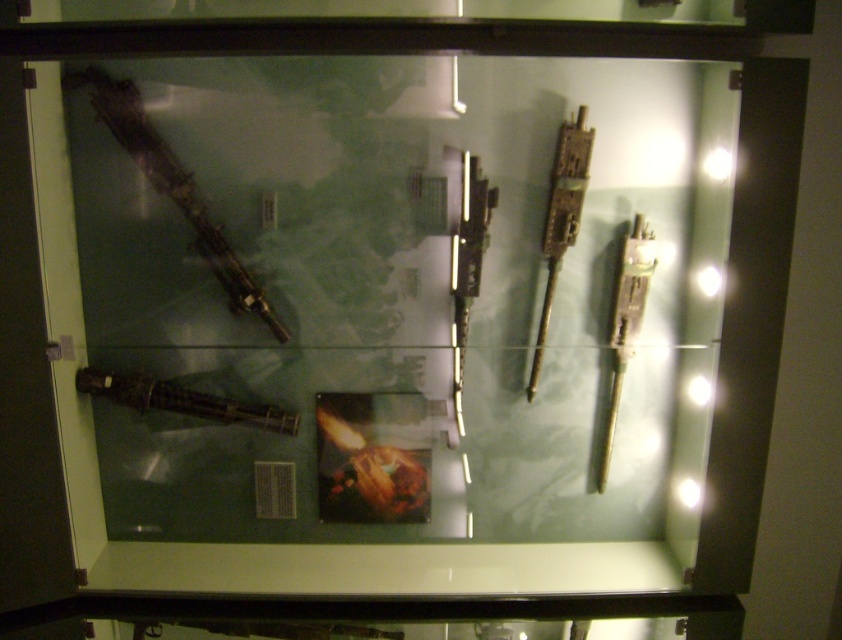
You are a museum visitor standing in front of the display case. You see a point marked at coordinates (x=561, y=218). What object is located at that point?

The point at coordinates (x=561, y=218) indicates the rusty metal gun at upper right.

You are a museum security guard checking the display case. You notice the matte black gun at left and the metallic silver gun at center. Which gun is placed above the other in the display?

The matte black gun at left is positioned over the metallic silver gun at center in the display case.

You are a museum visitor standing in front of the display case. You notice the matte black gun at left and the matte black sword at lower left. Which of these two objects is positioned higher on the display case?

The matte black gun at left is positioned higher than the matte black sword at lower left because it is located above it in the display case.